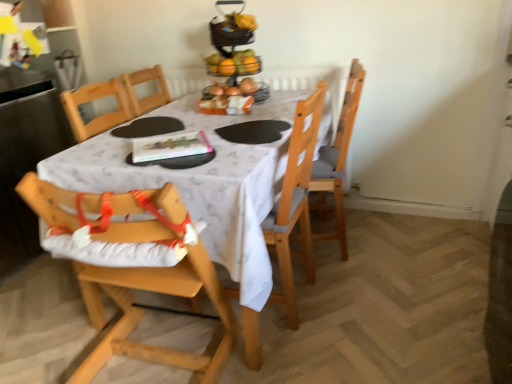
Find the location of a particular element. This screenshot has width=512, height=384. free location to the right of orange plastic basket at center is located at coordinates (275, 106).